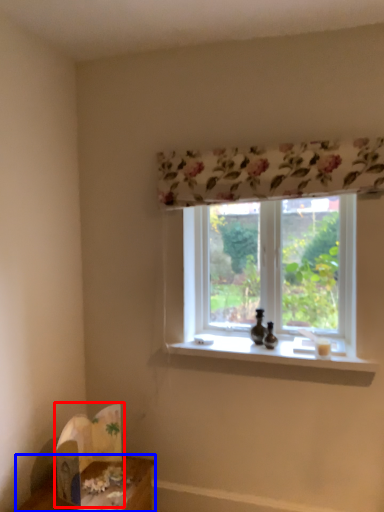
Question: Among these objects, which one is nearest to the camera, cardboard box (highlighted by a red box) or table (highlighted by a blue box)?

Choices:
 (A) cardboard box
 (B) table

Answer: (B)